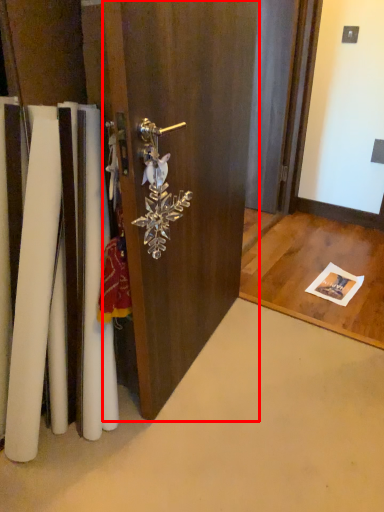
Question: From the image's perspective, what is the correct spatial positioning of door (annotated by the red box) in reference to door handle?

Choices:
 (A) above
 (B) below

Answer: (A)